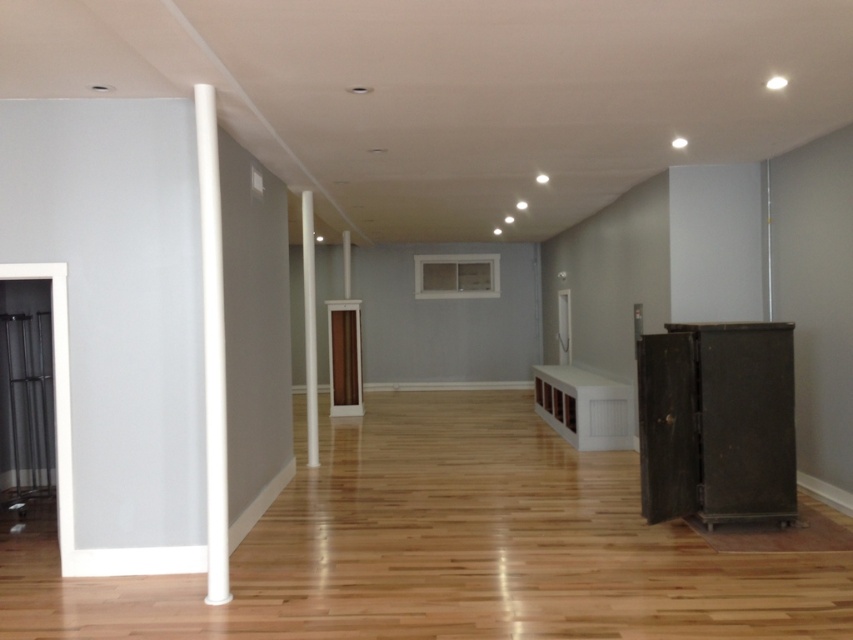
You are a painter who needs to hang a large canvas. You have two options for support structures in the room described. Which object, the white smooth pole at left or the white glossy pillar at center, would be more suitable for hanging a canvas due to its height?

The white smooth pole at left is much taller than the white glossy pillar at center, making it a better option for hanging a large canvas that requires more vertical space.

You are standing in the room and want to move from the white glossy pillar at center to the white smooth pole at left. Which direction should you face to walk towards the pole?

To move from the white glossy pillar at center to the white smooth pole at left, you should face left because the white smooth pole at left is located to the right of the white glossy pillar at center.